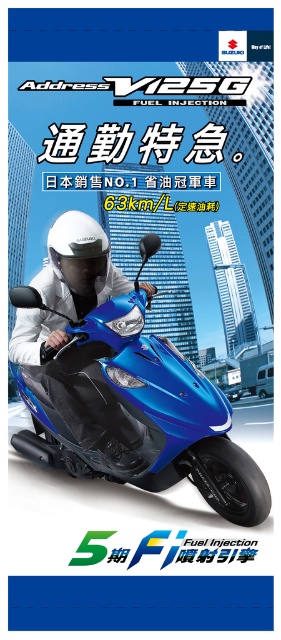
You are a photographer trying to capture the glossy blue scooter at center and the matte blue helmet at upper left in a single shot. Based on their sizes, which object should you focus on first to ensure both are in frame?

The glossy blue scooter at center is bigger than the matte blue helmet at upper left, so you should focus on the glossy blue scooter at center first to ensure both are in frame.

You are a delivery person who needs to park your scooter in a parking spot that requires vehicles to be placed at the center of the spot. Given the coordinates provided, can you determine if the glossy blue scooter at center is properly parked?

The glossy blue scooter at center is positioned at coordinates point [132,408], so it is properly parked at the center of the parking spot.

You are a graphic designer working on this advertisement. You need to ensure that the glossy blue scooter at center and the matte blue helmet at upper left are positioned in a way that they don not overlap. Given their current distance is 7.52 inches, what is the minimum distance required between them to prevent overlapping?

The minimum distance required between the glossy blue scooter at center and the matte blue helmet at upper left to prevent overlapping is 7.52 inches, which is already maintained in the current design.